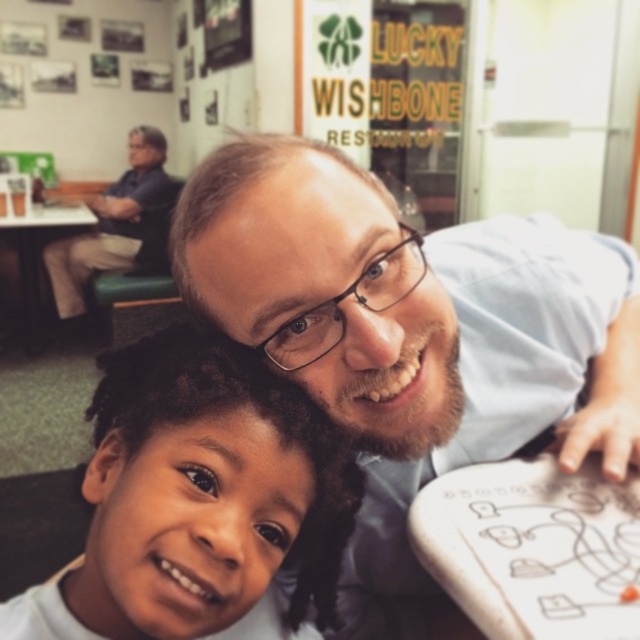
Question: Which point is closer to the camera taking this photo?

Choices:
 (A) (120, 179)
 (B) (404, 492)

Answer: (B)

Question: Can you confirm if light blue shirt at center is bigger than smooth skin child at center?

Choices:
 (A) no
 (B) yes

Answer: (B)

Question: Based on their relative distances, which object is farther from the smooth skin child at center?

Choices:
 (A) dark blue shirt at upper left
 (B) light blue shirt at center

Answer: (A)

Question: Which of these objects is positioned farthest from the dark blue shirt at upper left?

Choices:
 (A) light blue shirt at center
 (B) smooth skin child at center

Answer: (B)

Question: Does smooth skin child at center have a greater width compared to dark blue shirt at upper left?

Choices:
 (A) no
 (B) yes

Answer: (A)

Question: Can you confirm if smooth skin child at center is positioned below dark blue shirt at upper left?

Choices:
 (A) yes
 (B) no

Answer: (A)